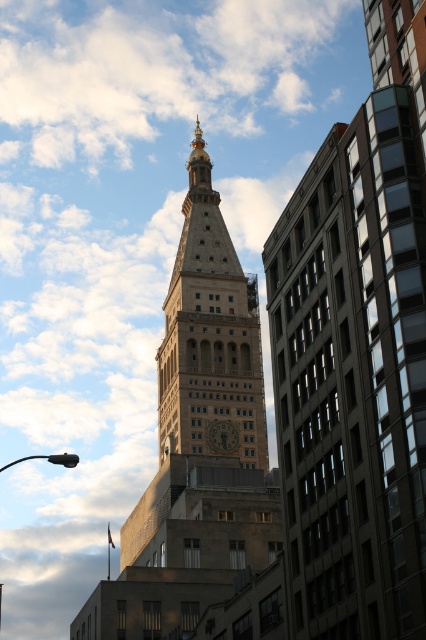
Question: Does golden stone clock tower at center lie in front of gold metallic clock at center?

Choices:
 (A) yes
 (B) no

Answer: (A)

Question: Among these objects, which one is nearest to the camera?

Choices:
 (A) gold metallic clock at center
 (B) golden stone clock tower at center

Answer: (B)

Question: Does golden stone clock tower at center appear on the right side of gold metallic clock at center?

Choices:
 (A) no
 (B) yes

Answer: (A)

Question: Which of the following is the closest to the observer?

Choices:
 (A) gold metallic clock at center
 (B) golden stone clock tower at center

Answer: (B)

Question: Can you confirm if golden stone clock tower at center is wider than gold metallic clock at center?

Choices:
 (A) no
 (B) yes

Answer: (B)